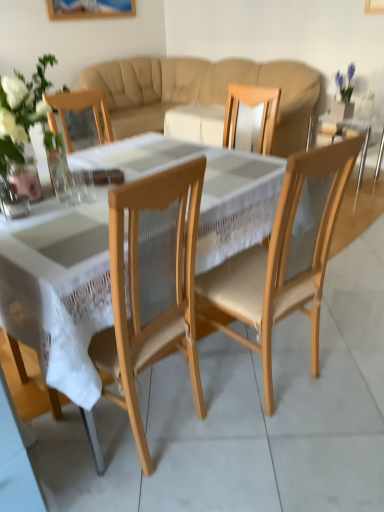
At what (x,y) coordinates should I click in order to perform the action: click on free point behind clear glass at center, which is the 1th tableware from left to right. Please return your answer as a coordinate pair (x, y). The height and width of the screenshot is (512, 384). Looking at the image, I should click on (77, 189).